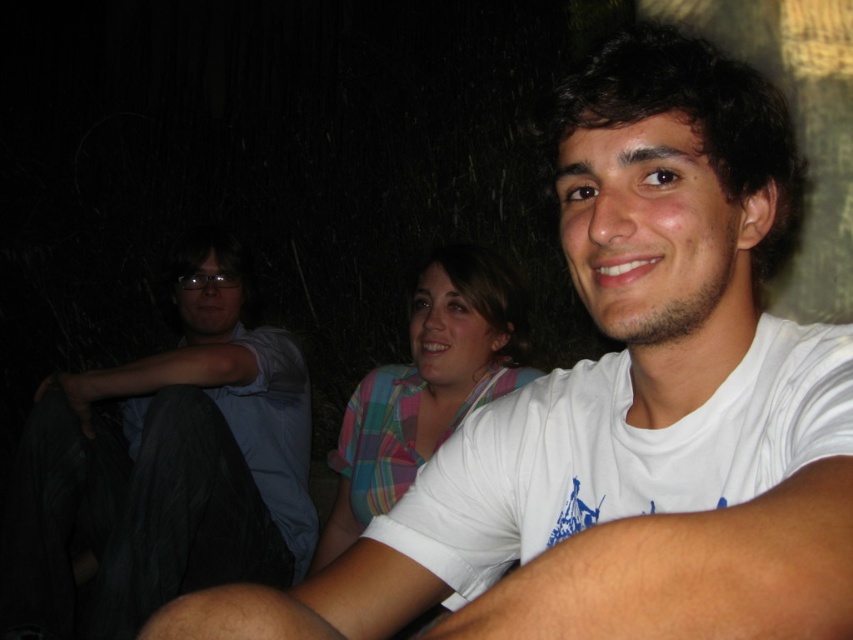
Can you confirm if light blue shirt at left is shorter than plaid fabric shirt at center?

Incorrect, light blue shirt at left's height does not fall short of plaid fabric shirt at center's.

This screenshot has height=640, width=853. What are the coordinates of `light blue shirt at left` in the screenshot? It's located at (165, 467).

Is point (247, 438) closer to viewer compared to point (383, 499)?

No, (247, 438) is further to viewer.

Where is `light blue shirt at left`? light blue shirt at left is located at coordinates (165, 467).